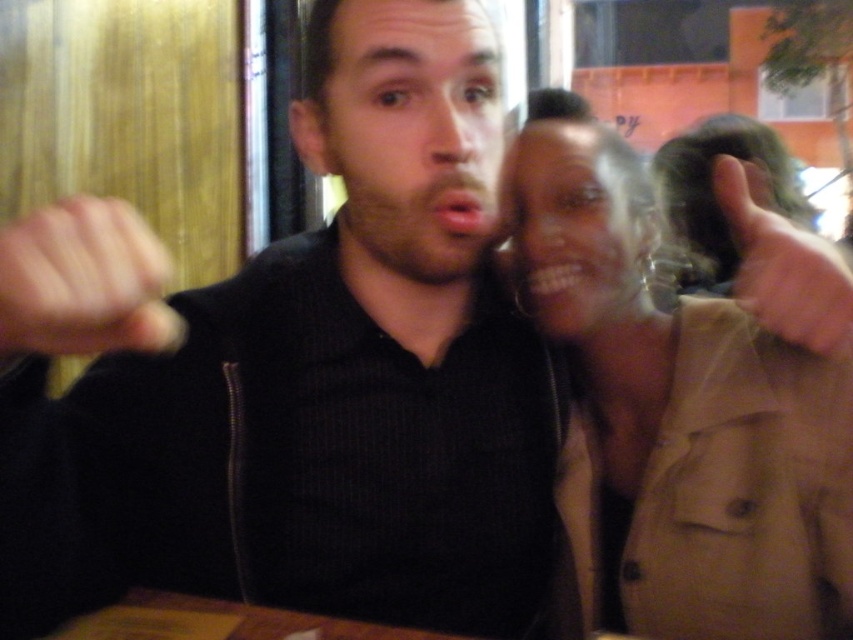
Question: Which point is farther to the camera?

Choices:
 (A) matte black fist at center
 (B) tan fabric jacket at upper right
 (C) black matte shirt at center

Answer: (B)

Question: Does black matte shirt at center appear on the right side of skinny beige hand at upper right?

Choices:
 (A) no
 (B) yes

Answer: (A)

Question: Is matte black fist at center below skinny beige hand at upper right?

Choices:
 (A) yes
 (B) no

Answer: (A)

Question: Which object is closer to the camera taking this photo?

Choices:
 (A) beardsoftface at center
 (B) matte skin face at upper right
 (C) black matte shirt at center
 (D) tan fabric jacket at upper right

Answer: (C)

Question: Is black matte shirt at center smaller than beardsoftface at center?

Choices:
 (A) yes
 (B) no

Answer: (B)

Question: Among these objects, which one is farthest from the camera?

Choices:
 (A) skinny beige hand at upper right
 (B) beardsoftface at center

Answer: (B)